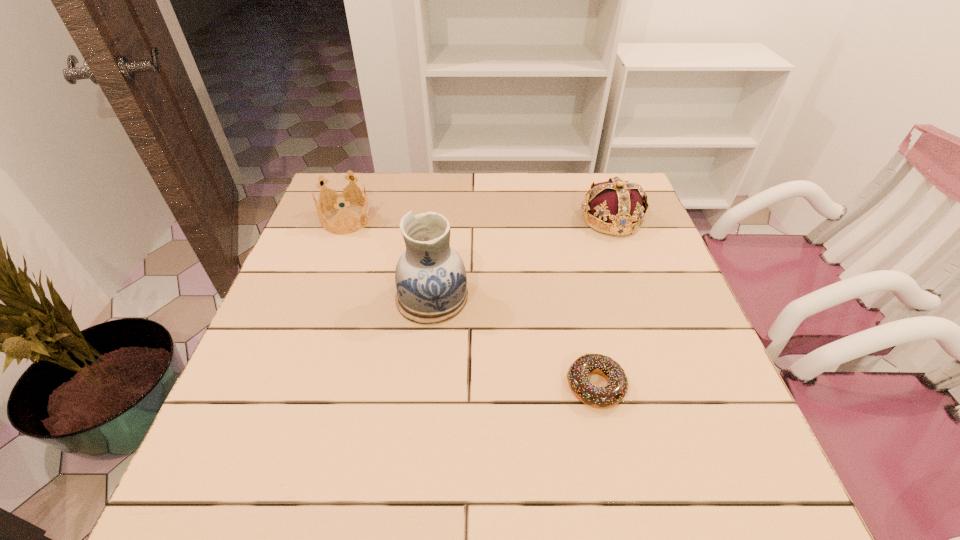
The image size is (960, 540). I want to click on vacant region between the third tallest object and the shortest object, so click(x=471, y=303).

The width and height of the screenshot is (960, 540). I want to click on free area in between the nearest object and the left crown, so click(471, 303).

At what (x,y) coordinates should I click in order to perform the action: click on empty location between the nearest object and the pottery. Please return your answer as a coordinate pair (x, y). This screenshot has width=960, height=540. Looking at the image, I should click on (514, 342).

Identify the location of empty space between the right crown and the third tallest object. (479, 220).

Find the location of a particular element. This screenshot has height=540, width=960. vacant area that lies between the nearest object and the shorter crown is located at coordinates (471, 303).

At what (x,y) coordinates should I click in order to perform the action: click on vacant area between the right crown and the nearest object. Please return your answer as a coordinate pair (x, y). Looking at the image, I should click on (604, 303).

The image size is (960, 540). Identify the location of free space between the nearest object and the left crown. (471, 303).

Identify the location of vacant space that is in between the right crown and the nearest object. (604, 303).

In order to click on vacant area between the right crown and the shortest object in this screenshot , I will do `click(604, 303)`.

Locate an element on the screen. This screenshot has width=960, height=540. empty location between the second shortest object and the right crown is located at coordinates (479, 220).